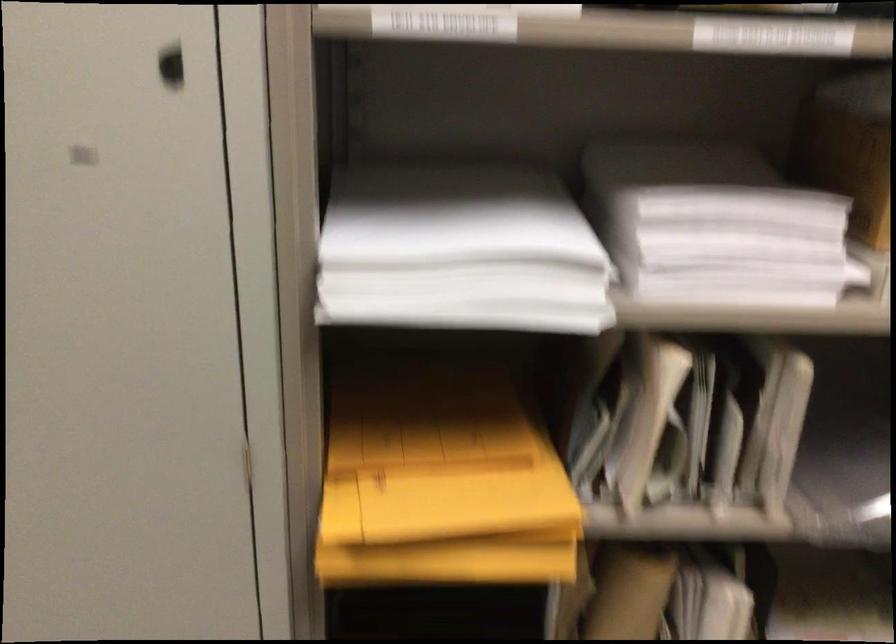
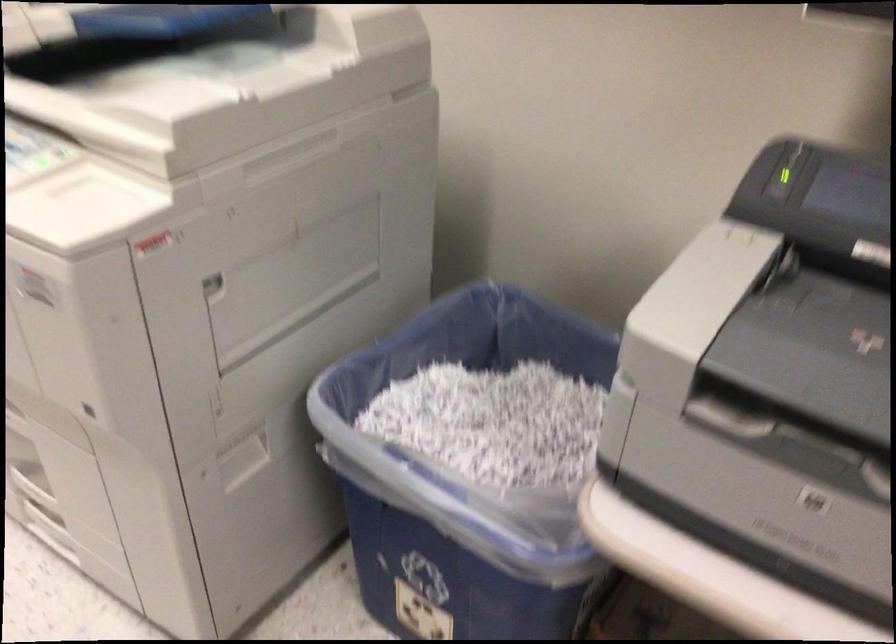
Looking at this image, the first image is from the beginning of the video and the second image is from the end. How did the camera likely rotate when shooting the video?

The rotation direction of the camera is right-down.